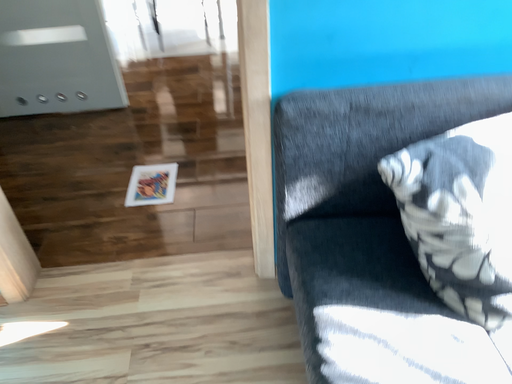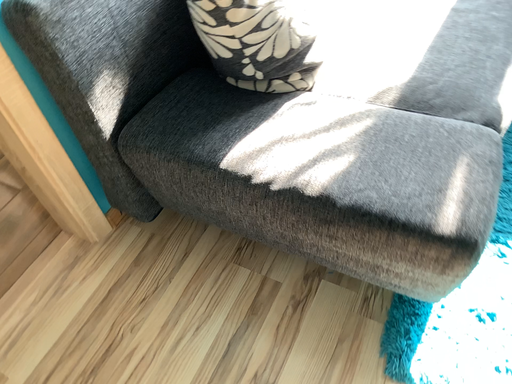
Question: Which way did the camera rotate in the video?

Choices:
 (A) rotated left
 (B) rotated right

Answer: (B)